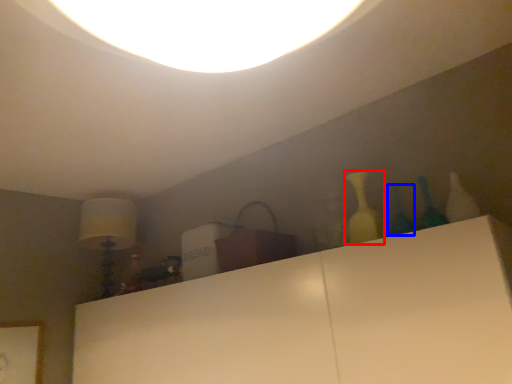
Question: Among these objects, which one is nearest to the camera, bottle (highlighted by a red box) or glass vase (highlighted by a blue box)?

Choices:
 (A) bottle
 (B) glass vase

Answer: (B)